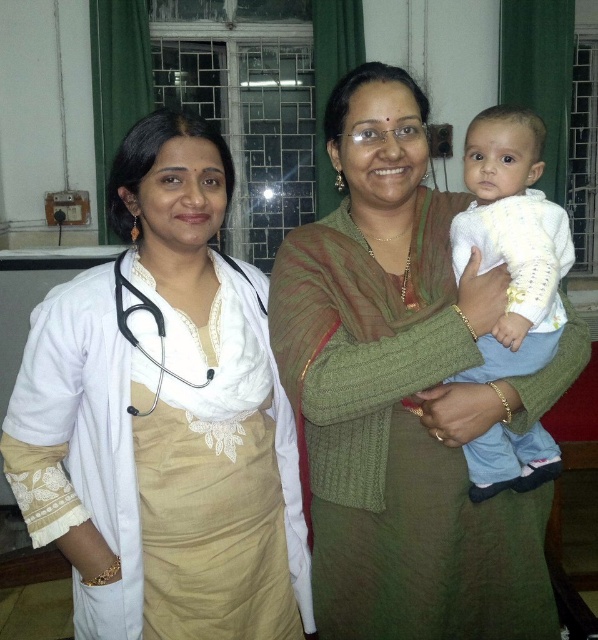
In the scene described, there is a green knitted sweater at center and a white matte stethoscope at left. From the perspective of an observer standing in front of the image, which object is positioned to the right of the other?

The green knitted sweater at center is to the right of the white matte stethoscope at left.

You are a patient in a medical setting and see the white lace dress at left and the white matte stethoscope at left. Which object is positioned higher on the person?

The white lace dress at left is much taller than the white matte stethoscope at left, so the white lace dress at left is positioned higher on the person.